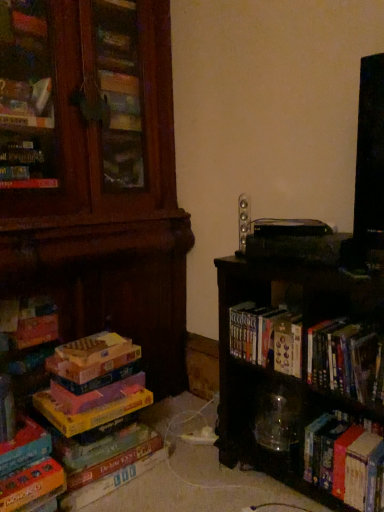
You are a GUI agent. You are given a task and a screenshot of the screen. Output one action in this format:
    pyautogui.click(x=<x>, y=<y>)
    Task: Click on the vacant space to the left of black matte bookshelf at right
    Image resolution: width=384 pixels, height=512 pixels.
    Given the screenshot: What is the action you would take?
    pyautogui.click(x=197, y=480)